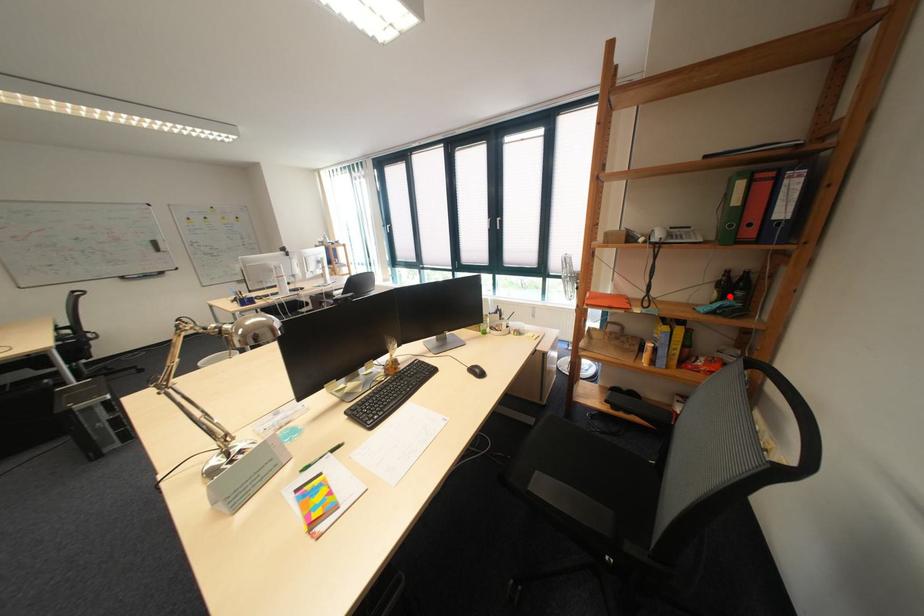
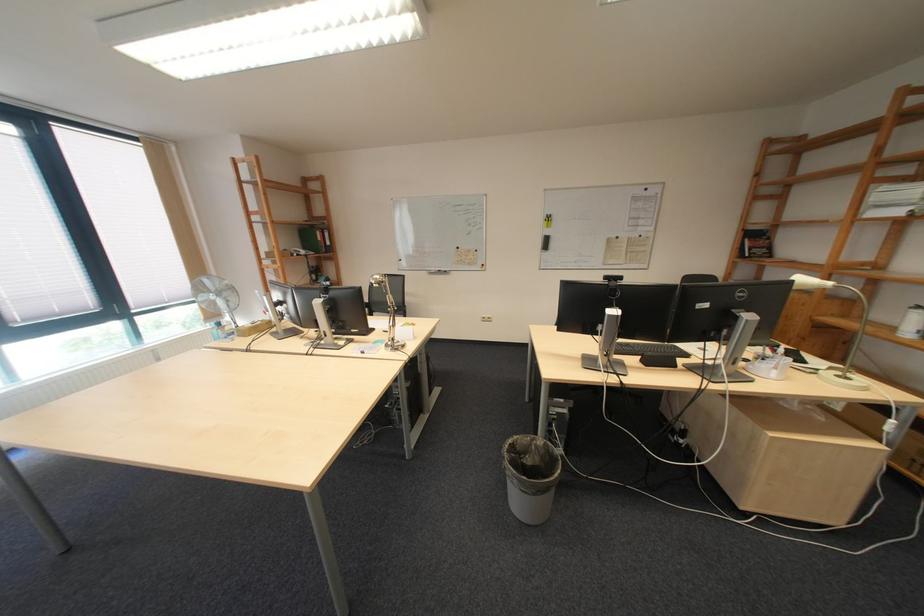
Question: I am providing you with two images of the same scene from different viewpoints. Given a red point in image1, look at the same physical point in image2. Is it:

Choices:
 (A) Closer to the viewpoint
 (B) Farther from the viewpoint

Answer: (B)